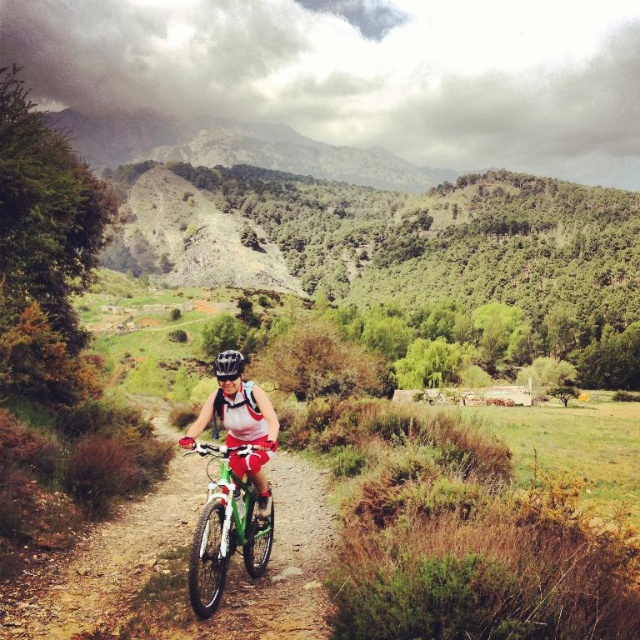
Question: Considering the relative positions of green matte bicycle at center and matte white helmet at center in the image provided, where is green matte bicycle at center located with respect to matte white helmet at center?

Choices:
 (A) left
 (B) right

Answer: (A)

Question: Based on their relative distances, which object is nearer to the green matte bicycle at center?

Choices:
 (A) black matte bicycle helmet at center
 (B) matte white helmet at center

Answer: (B)

Question: Based on their relative distances, which object is farther from the green matte bicycle at center?

Choices:
 (A) black matte bicycle helmet at center
 (B) matte white helmet at center

Answer: (A)

Question: Is green matte bicycle at center further to camera compared to black matte bicycle helmet at center?

Choices:
 (A) yes
 (B) no

Answer: (B)

Question: Which object is farther from the camera taking this photo?

Choices:
 (A) green matte bicycle at center
 (B) black matte bicycle helmet at center

Answer: (B)

Question: Does green matte bicycle at center have a smaller size compared to black matte bicycle helmet at center?

Choices:
 (A) no
 (B) yes

Answer: (B)